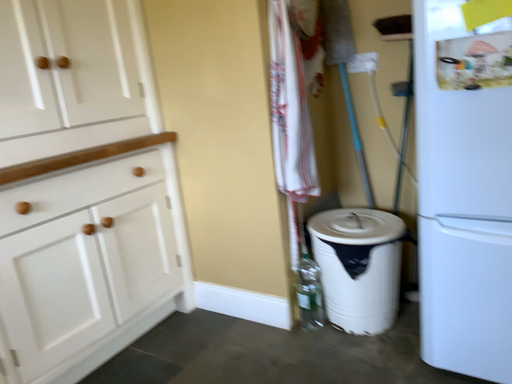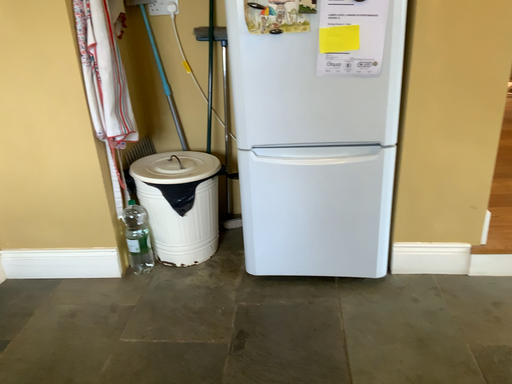
Question: Which way did the camera rotate in the video?

Choices:
 (A) rotated left
 (B) rotated right

Answer: (B)